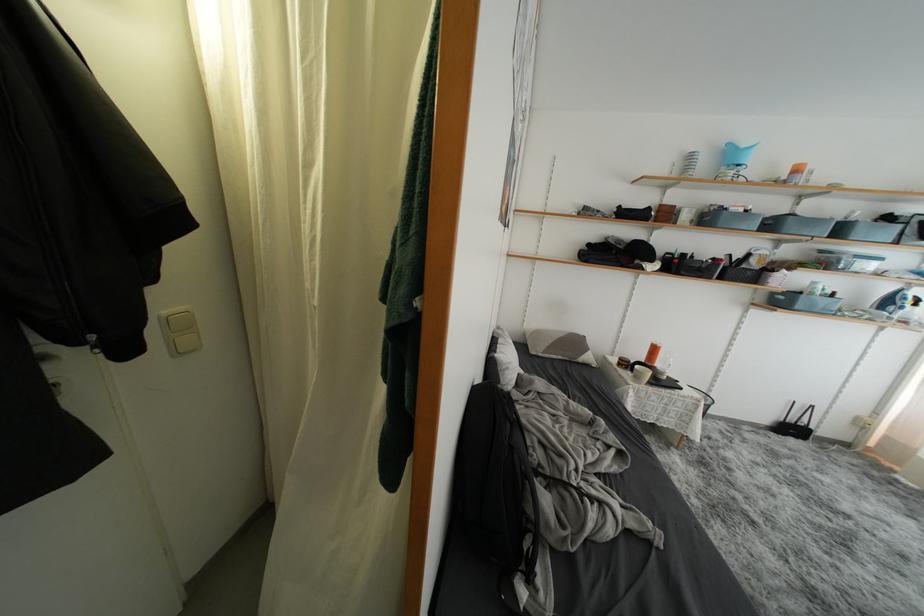
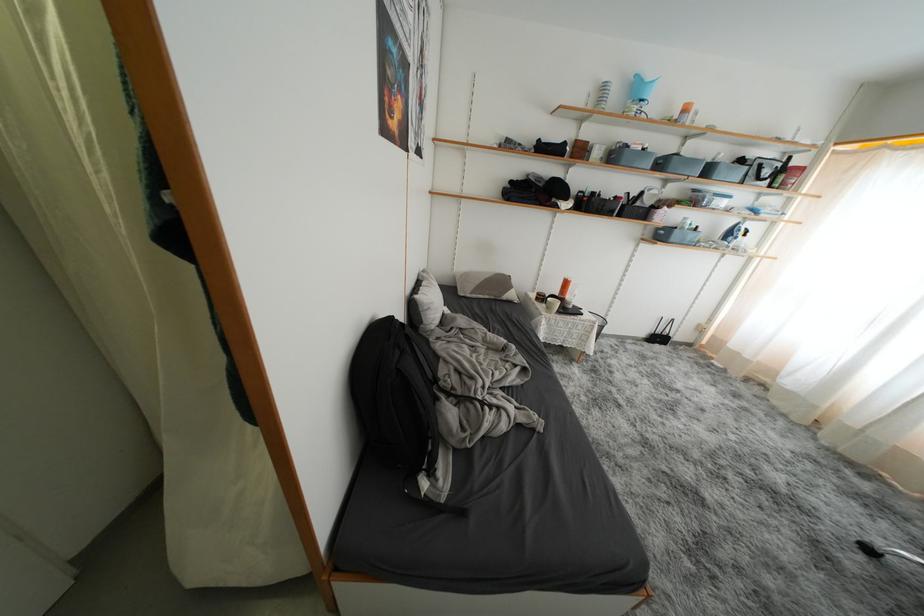
The point at (847, 235) is marked in the first image. Where is the corresponding point in the second image?

(714, 175)